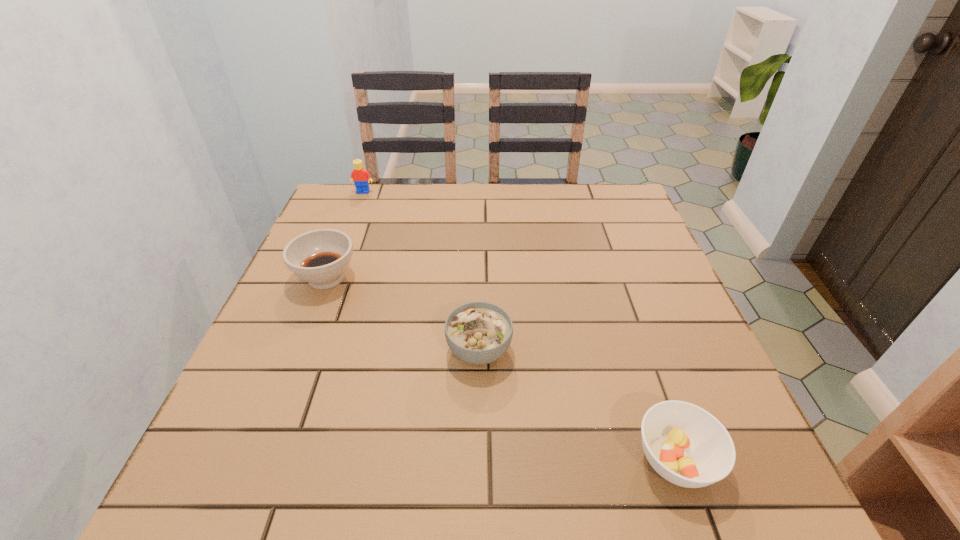
This screenshot has width=960, height=540. Find the location of `vacant space at the near edge of the desktop`. vacant space at the near edge of the desktop is located at coordinates (453, 491).

The image size is (960, 540). Find the location of `vacant point at the left edge`. vacant point at the left edge is located at coordinates (224, 418).

The width and height of the screenshot is (960, 540). Find the location of `vacant space at the right edge`. vacant space at the right edge is located at coordinates (636, 319).

This screenshot has width=960, height=540. I want to click on blank space at the far left corner of the desktop, so [x=336, y=184].

At what (x,y) coordinates should I click in order to perform the action: click on free space at the far right corner of the desktop. Please return your answer as a coordinate pair (x, y). The width and height of the screenshot is (960, 540). Looking at the image, I should click on (580, 200).

This screenshot has height=540, width=960. I want to click on free space between the rightmost object and the second farthest object, so click(501, 369).

The width and height of the screenshot is (960, 540). I want to click on vacant region between the farthest object and the nearest soup bowl, so click(x=519, y=326).

At what (x,y) coordinates should I click in order to perform the action: click on blank region between the second soup bowl from right to left and the shortest object. Please return your answer as a coordinate pair (x, y). This screenshot has width=960, height=540. Looking at the image, I should click on (577, 405).

At what (x,y) coordinates should I click in order to perform the action: click on free space between the third nearest object and the nearest object. Please return your answer as a coordinate pair (x, y). This screenshot has height=540, width=960. Looking at the image, I should click on 501,369.

Find the location of a particular element. empty space that is in between the third object from left to right and the nearest object is located at coordinates (577, 405).